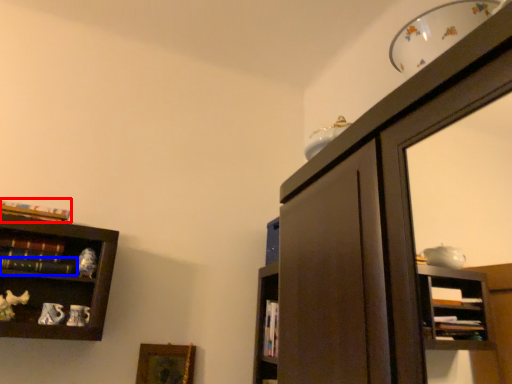
Question: Which object is closer to the camera taking this photo, book (highlighted by a red box) or book (highlighted by a blue box)?

Choices:
 (A) book
 (B) book

Answer: (B)